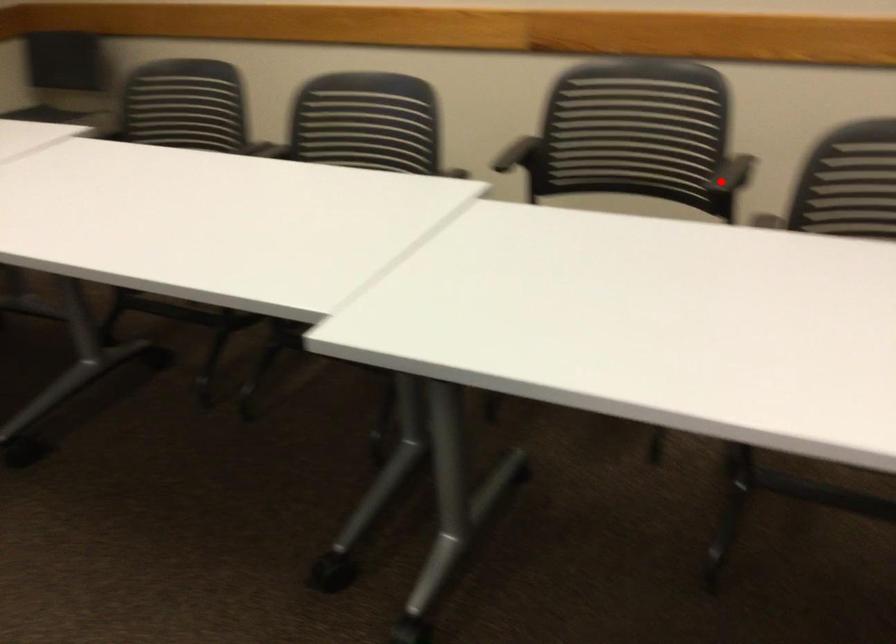
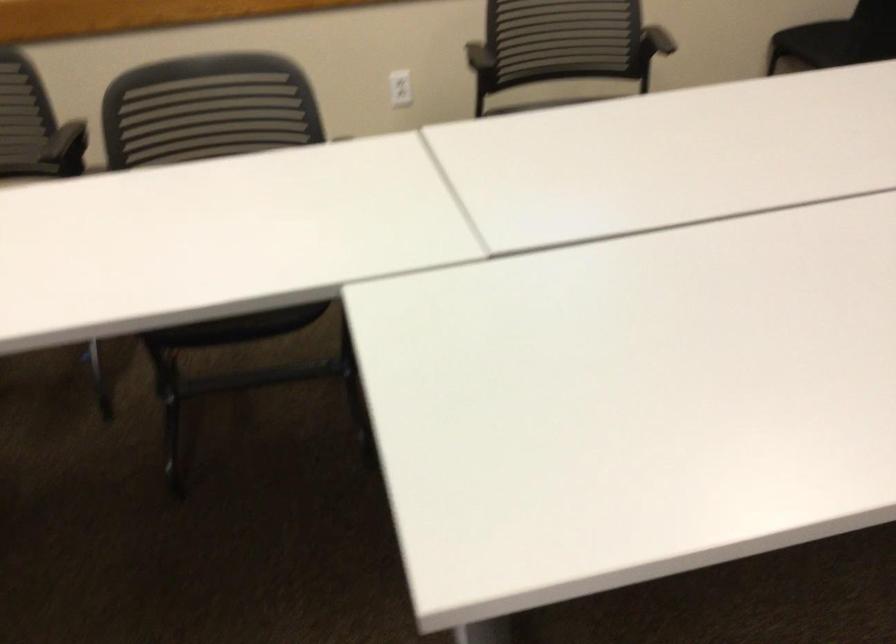
Find the pixel in the second image that matches the highlighted location in the first image.

(67, 149)